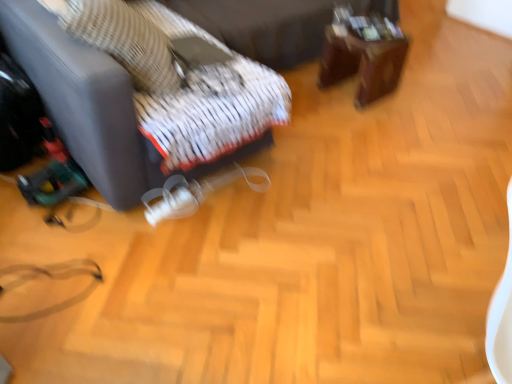
At what (x,y) coordinates should I click in order to perform the action: click on woven fabric pillow at upper left. Please return your answer as a coordinate pair (x, y). Image resolution: width=512 pixels, height=384 pixels. Looking at the image, I should click on (125, 41).

At what (x,y) coordinates should I click in order to perform the action: click on white textured fabric bed frame at upper center. Please return your answer as a coordinate pair (x, y). The height and width of the screenshot is (384, 512). Looking at the image, I should click on (274, 25).

Consider the image. From a real-world perspective, is matte black suitcase at lower left on woven fabric pillow at upper left?

No, from a real-world perspective, matte black suitcase at lower left is not on top of woven fabric pillow at upper left.

Does matte black suitcase at lower left have a smaller size compared to woven fabric pillow at upper left?

No, matte black suitcase at lower left is not smaller than woven fabric pillow at upper left.

Could you tell me if matte black suitcase at lower left is facing woven fabric pillow at upper left?

Yes, matte black suitcase at lower left is facing woven fabric pillow at upper left.

Choose the correct answer: Is matte black suitcase at lower left inside woven fabric pillow at upper left or outside it?

matte black suitcase at lower left is not enclosed by woven fabric pillow at upper left.

Looking at their sizes, would you say matte black suitcase at lower left is wider or thinner than white textured fabric bed frame at upper center?

In the image, matte black suitcase at lower left appears to be more narrow than white textured fabric bed frame at upper center.

Based on the photo, how distant is matte black suitcase at lower left from white textured fabric bed frame at upper center?

matte black suitcase at lower left and white textured fabric bed frame at upper center are 29.94 inches apart.

From a real-world perspective, between matte black suitcase at lower left and white textured fabric bed frame at upper center, who is vertically higher?

matte black suitcase at lower left is physically above.

How many degrees apart are the facing directions of matte black suitcase at lower left and white textured fabric bed frame at upper center?

There is a 90-degree angle between the facing directions of matte black suitcase at lower left and white textured fabric bed frame at upper center.

Is brown wooden table at upper right oriented towards woven fabric pillow at upper left?

No, brown wooden table at upper right is not aimed at woven fabric pillow at upper left.

Is woven fabric pillow at upper left completely or partially inside brown wooden table at upper right?

Definitely not — woven fabric pillow at upper left is not inside brown wooden table at upper right.

Based on their sizes in the image, would you say brown wooden table at upper right is bigger or smaller than woven fabric pillow at upper left?

Considering their sizes, brown wooden table at upper right takes up less space than woven fabric pillow at upper left.

Is woven fabric pillow at upper left bigger than white textured fabric bed frame at upper center?

No, woven fabric pillow at upper left is not bigger than white textured fabric bed frame at upper center.

Which is nearer, (x=130, y=41) or (x=370, y=3)?

Clearly, point (x=130, y=41) is closer to the camera than point (x=370, y=3).

You are a GUI agent. You are given a task and a screenshot of the screen. Output one action in this format:
    pyautogui.click(x=<x>, y=<y>)
    Task: Click on the pillow in front of the white textured fabric bed frame at upper center
    Image resolution: width=512 pixels, height=384 pixels.
    Given the screenshot: What is the action you would take?
    pyautogui.click(x=125, y=41)

Is woven fabric pillow at upper left next to white textured fabric bed frame at upper center and touching it?

No.

Can you confirm if white textured fabric bed frame at upper center is taller than matte black suitcase at lower left?

No.

From the image's perspective, which object appears higher, white textured fabric bed frame at upper center or matte black suitcase at lower left?

white textured fabric bed frame at upper center, from the image's perspective.

Which is more to the right, white textured fabric bed frame at upper center or matte black suitcase at lower left?

white textured fabric bed frame at upper center.

Which object is positioned more to the left, white textured fabric bed frame at upper center or woven fabric pillow at upper left?

Positioned to the left is woven fabric pillow at upper left.

From the image's perspective, would you say white textured fabric bed frame at upper center is shown under woven fabric pillow at upper left?

No, from the image's perspective, white textured fabric bed frame at upper center is not beneath woven fabric pillow at upper left.

Would you say white textured fabric bed frame at upper center is a long distance from woven fabric pillow at upper left?

No, white textured fabric bed frame at upper center is not far from woven fabric pillow at upper left.

Does white textured fabric bed frame at upper center have a lesser height compared to woven fabric pillow at upper left?

In fact, white textured fabric bed frame at upper center may be taller than woven fabric pillow at upper left.

Looking at this image, is woven fabric pillow at upper left oriented towards matte black suitcase at lower left?

Yes.

From a real-world perspective, who is located higher, woven fabric pillow at upper left or matte black suitcase at lower left?

From a 3D spatial view, woven fabric pillow at upper left is above.

Which is more to the left, woven fabric pillow at upper left or matte black suitcase at lower left?

matte black suitcase at lower left.

You are a GUI agent. You are given a task and a screenshot of the screen. Output one action in this format:
    pyautogui.click(x=<x>, y=<y>)
    Task: Click on the pillow located above the matte black suitcase at lower left (from a real-world perspective)
    
    Given the screenshot: What is the action you would take?
    pyautogui.click(x=125, y=41)

You are a GUI agent. You are given a task and a screenshot of the screen. Output one action in this format:
    pyautogui.click(x=<x>, y=<y>)
    Task: Click on the bed frame lying behind the matte black suitcase at lower left
    The width and height of the screenshot is (512, 384).
    Given the screenshot: What is the action you would take?
    pyautogui.click(x=274, y=25)

When comparing their distances from woven fabric pillow at upper left, does brown wooden table at upper right or white textured fabric bed frame at upper center seem closer?

The object closer to woven fabric pillow at upper left is white textured fabric bed frame at upper center.

Considering their positions, is brown wooden table at upper right positioned further to white textured fabric bed frame at upper center than matte black suitcase at lower left?

The object further to white textured fabric bed frame at upper center is matte black suitcase at lower left.

When comparing their distances from matte black suitcase at lower left, does woven fabric pillow at upper left or white textured fabric bed frame at upper center seem closer?

woven fabric pillow at upper left.

From the image, which object appears to be farther from white textured fabric bed frame at upper center, brown wooden table at upper right or woven fabric pillow at upper left?

woven fabric pillow at upper left is further to white textured fabric bed frame at upper center.

Considering their positions, is brown wooden table at upper right positioned further to woven fabric pillow at upper left than matte black suitcase at lower left?

brown wooden table at upper right is positioned further to the anchor woven fabric pillow at upper left.

Considering their positions, is woven fabric pillow at upper left positioned further to brown wooden table at upper right than matte black suitcase at lower left?

Based on the image, woven fabric pillow at upper left appears to be further to brown wooden table at upper right.

Estimate the real-world distances between objects in this image. Which object is further from woven fabric pillow at upper left, matte black suitcase at lower left or brown wooden table at upper right?

The object further to woven fabric pillow at upper left is brown wooden table at upper right.

Considering their positions, is white textured fabric bed frame at upper center positioned further to woven fabric pillow at upper left than brown wooden table at upper right?

brown wooden table at upper right is further to woven fabric pillow at upper left.

Identify the location of pillow between matte black suitcase at lower left and white textured fabric bed frame at upper center in the front-back direction. The width and height of the screenshot is (512, 384). (125, 41).

The image size is (512, 384). Identify the location of pillow situated between matte black suitcase at lower left and brown wooden table at upper right from left to right. (125, 41).

Locate an element on the screen. bed frame located between matte black suitcase at lower left and brown wooden table at upper right in the left-right direction is located at coordinates (274, 25).

Identify the location of bed frame situated between woven fabric pillow at upper left and brown wooden table at upper right from left to right. The width and height of the screenshot is (512, 384). (274, 25).